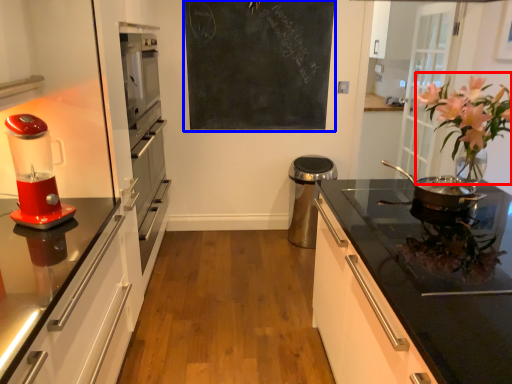
Question: Which of the following is the closest to the observer, floral arrangement (highlighted by a red box) or bulletin board (highlighted by a blue box)?

Choices:
 (A) floral arrangement
 (B) bulletin board

Answer: (A)